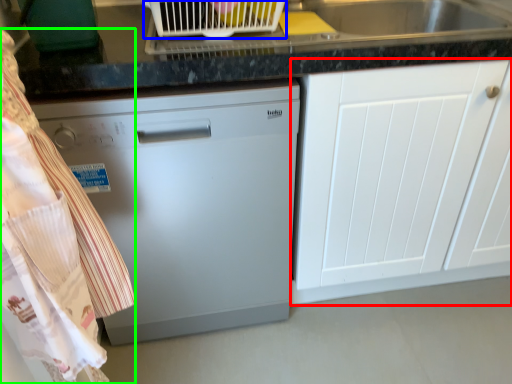
Question: Estimate the real-world distances between objects in this image. Which object is closer to cabinetry (highlighted by a red box), appliance (highlighted by a blue box) or laundry (highlighted by a green box)?

Choices:
 (A) appliance
 (B) laundry

Answer: (A)